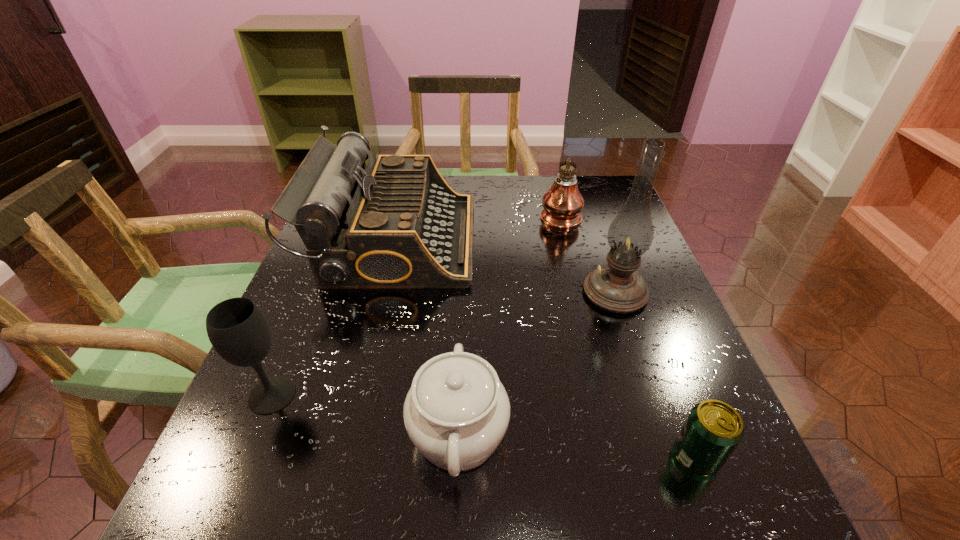
Locate an element on the screen. The image size is (960, 540). the third closest object to the chinaware is located at coordinates (617, 287).

I want to click on blank area in the image that satisfies the following two spatial constraints: 1. on the keyboard of the typewriter; 2. on the left side of the taller oil lamp, so pyautogui.click(x=382, y=292).

Image resolution: width=960 pixels, height=540 pixels. I want to click on free location that satisfies the following two spatial constraints: 1. on the back side of the nearer oil lamp; 2. on the keyboard of the typewriter, so click(x=597, y=240).

Locate an element on the screen. free space that satisfies the following two spatial constraints: 1. on the front side of the farther oil lamp; 2. on the left side of the taller oil lamp is located at coordinates (580, 292).

Locate an element on the screen. vacant space that satisfies the following two spatial constraints: 1. on the keyboard of the typewriter; 2. on the right side of the chinaware is located at coordinates (348, 434).

Where is `vacant space that satisfies the following two spatial constraints: 1. on the keyboard of the chinaware; 2. on the left side of the typewriter`? The image size is (960, 540). vacant space that satisfies the following two spatial constraints: 1. on the keyboard of the chinaware; 2. on the left side of the typewriter is located at coordinates (348, 434).